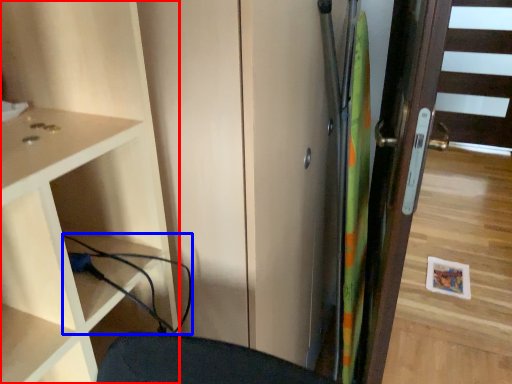
Question: Which point is further to the camera, cupboard (highlighted by a red box) or cable (highlighted by a blue box)?

Choices:
 (A) cupboard
 (B) cable

Answer: (B)